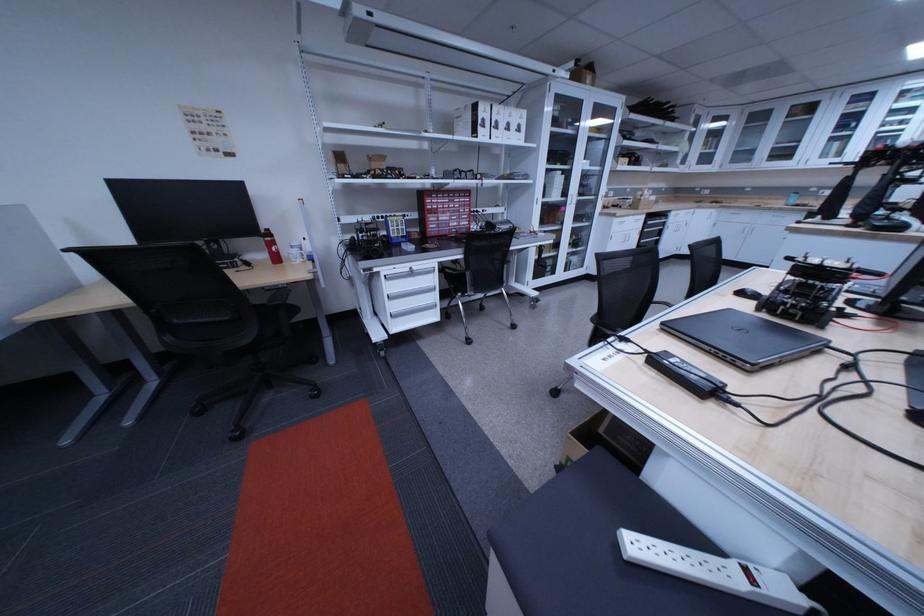
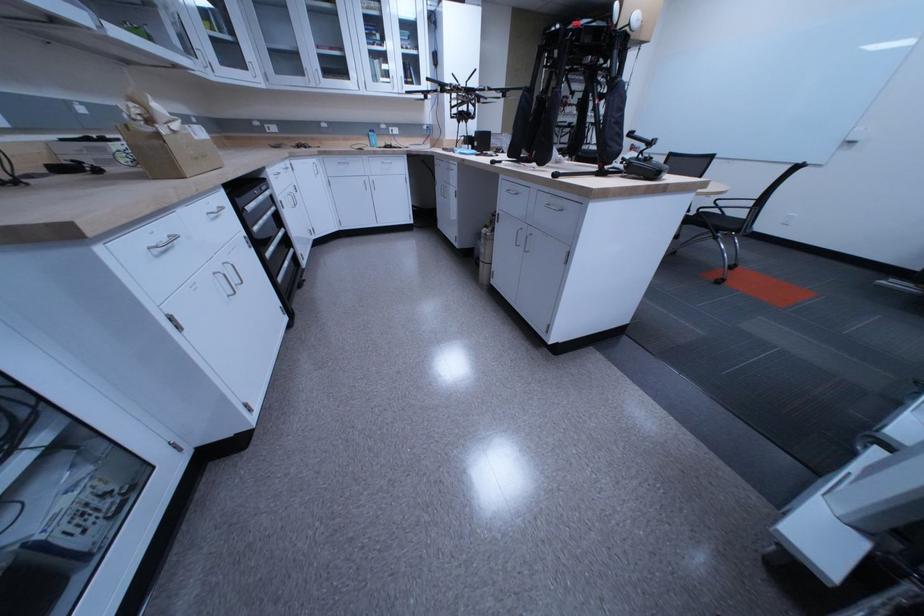
Where in the second image is the point corresponding to (x=655, y=201) from the first image?

(174, 137)